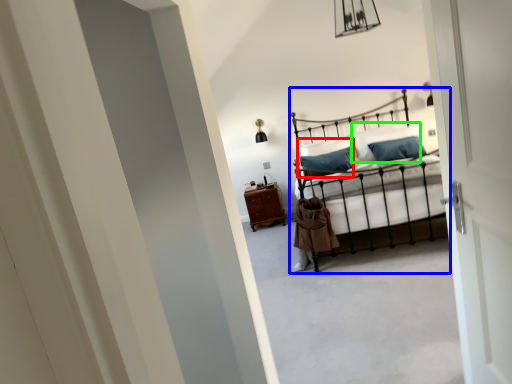
Question: Which object is positioned farthest from pillow (highlighted by a red box)? Select from bed (highlighted by a blue box) and pillow (highlighted by a green box).

Choices:
 (A) bed
 (B) pillow

Answer: (B)